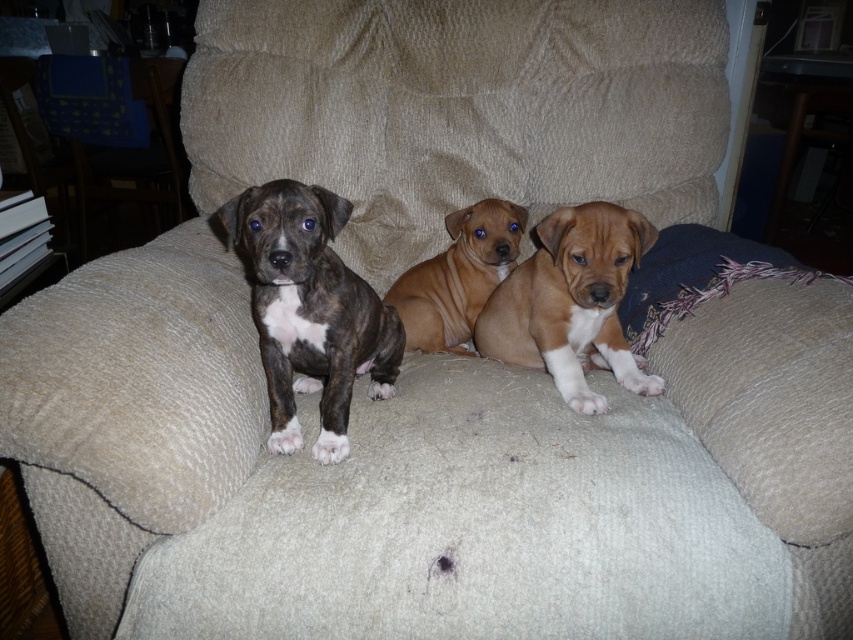
You are a photographer trying to capture a group photo of the brindle fur puppy at left and the brown smooth dog at center. The camera you are using has a minimum focus distance of 12 inches. Will you be able to focus on both puppies if they remain in their current positions?

The brindle fur puppy at left and the brown smooth dog at center are 11.93 inches apart from each other. Since the minimum focus distance is 12 inches, the camera cannot focus on both puppies simultaneously as they are too close together.

You are a photographer standing 5 feet away from the brindle fur puppy at left. You want to take a photo of all three puppies in the scene. Can you fit all three puppies into the frame without moving your position? Please explain your reasoning.

The three puppies are 33.43 inches apart. Since you are standing 5 feet away from the brindle fur puppy at left, the distance between you and the farthest puppy would be 5 feet plus 33.43 inches. Converting 5 feet to inches gives 60 inches. Adding 33.43 inches results in 93.43 inches total distance. However, typical camera lenses can capture objects within a certain range. Assuming a standard lens with a 50mm focal length, the field of view at 93.43 inches might be too narrow to include all puppies. To fit,

In the scene shown: You are a photographer trying to capture a closeup shot of the brindle fur puppy at left. You have a focus point set at point (310, 310). Will this point be on the brindle fur puppy at left?

Yes, the point (310, 310) is on the brindle fur puppy at left, so the focus point will be correctly placed.